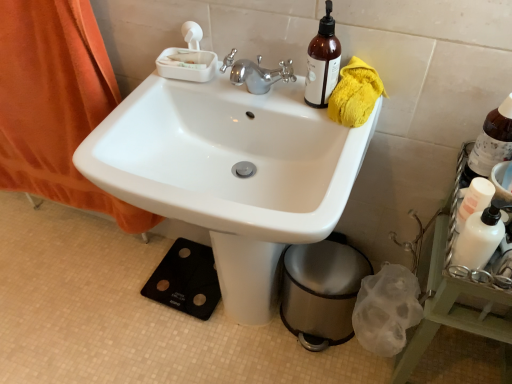
The height and width of the screenshot is (384, 512). In order to click on free point in front of metallic trash can at lower right in this screenshot , I will do `click(321, 369)`.